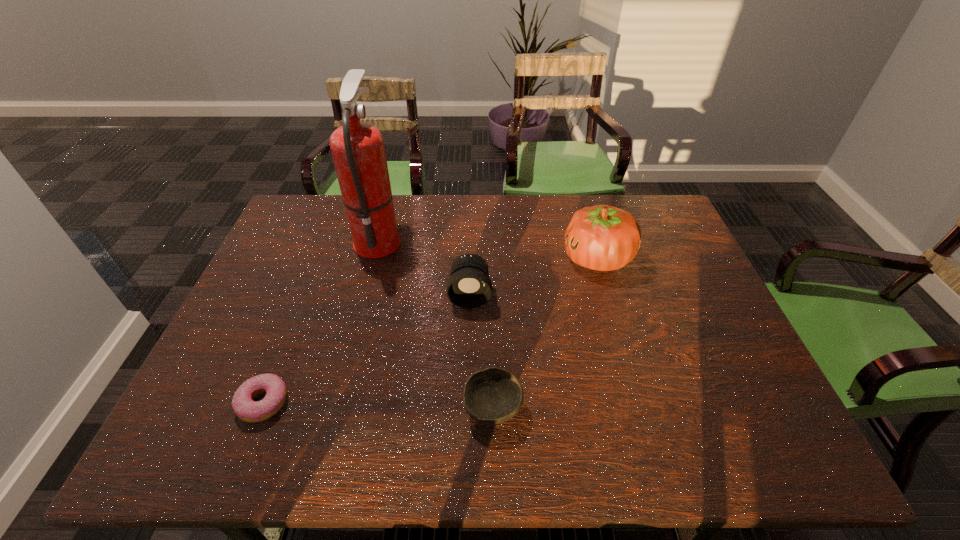
Find the location of `vacant area that lies between the leftmost object and the pumpkin`. vacant area that lies between the leftmost object and the pumpkin is located at coordinates (430, 330).

The image size is (960, 540). I want to click on free space between the second object from left to right and the bowl, so click(x=436, y=323).

You are a GUI agent. You are given a task and a screenshot of the screen. Output one action in this format:
    pyautogui.click(x=<x>, y=<y>)
    Task: Click on the free spot between the rightmost object and the third tallest object
    
    Given the screenshot: What is the action you would take?
    pyautogui.click(x=534, y=276)

Image resolution: width=960 pixels, height=540 pixels. Identify the location of free space between the third shortest object and the doughnut. (367, 348).

At what (x,y) coordinates should I click in order to perform the action: click on vacant space in between the pumpkin and the telephoto lens. Please return your answer as a coordinate pair (x, y). Looking at the image, I should click on (534, 276).

This screenshot has width=960, height=540. What are the coordinates of `object that is the third closest to the fire extinguisher` in the screenshot? It's located at (491, 396).

Find the location of `object that stands as the third closest to the fourth tallest object`. object that stands as the third closest to the fourth tallest object is located at coordinates (244, 407).

This screenshot has width=960, height=540. Identify the location of free space in the image that satisfies the following two spatial constraints: 1. on the side of the pumpkin with the cute face; 2. at the front element of the telephoto lens. (608, 294).

This screenshot has height=540, width=960. I want to click on vacant space that satisfies the following two spatial constraints: 1. on the side of the pumpkin with the cute face; 2. at the front element of the telephoto lens, so click(608, 294).

Where is `free space that satisfies the following two spatial constraints: 1. on the side of the second tallest object with the cute face; 2. at the front element of the third tallest object`? This screenshot has height=540, width=960. free space that satisfies the following two spatial constraints: 1. on the side of the second tallest object with the cute face; 2. at the front element of the third tallest object is located at coordinates (608, 294).